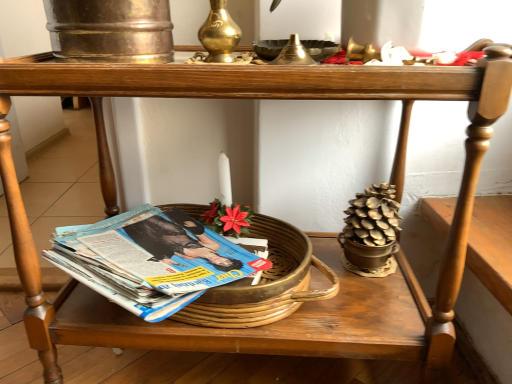
In order to click on vacant space to the right of brass candle holder at upper center, placed as the 1th candle holder when sorted from left to right in this screenshot , I will do `click(337, 58)`.